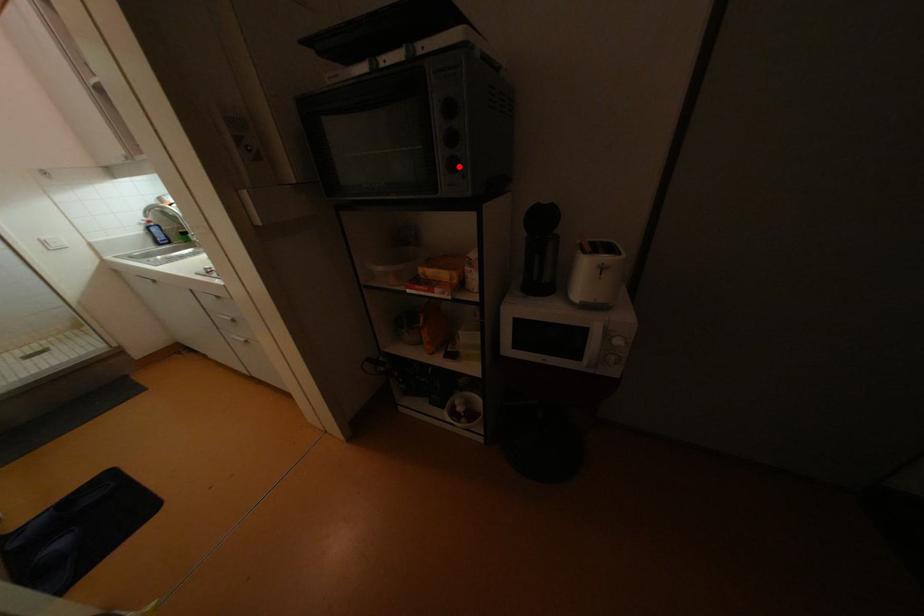
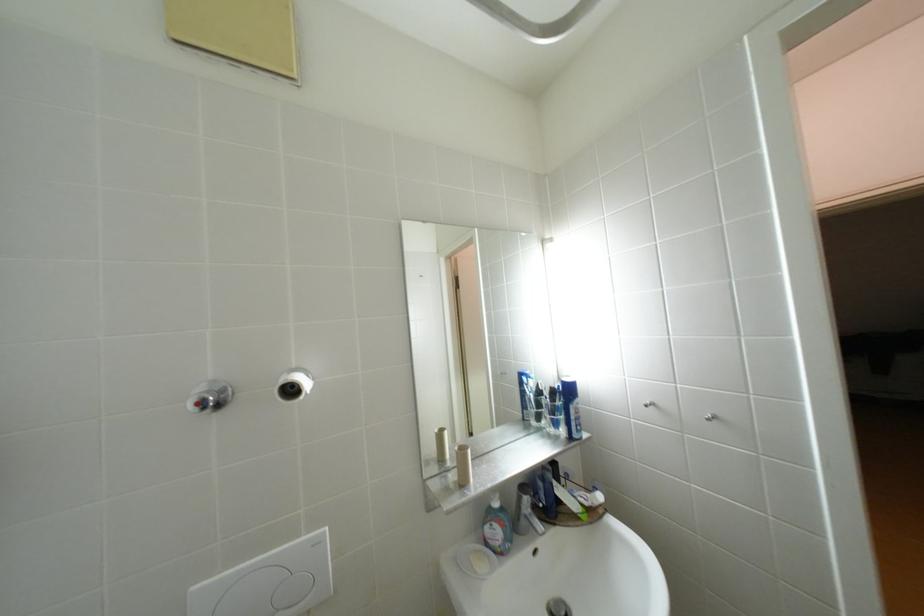
Question: I am providing you with two images of the same scene from different viewpoints. A red point is marked on the first image. Can you still see the location of the red point in image 2?

Choices:
 (A) Yes
 (B) No

Answer: (B)